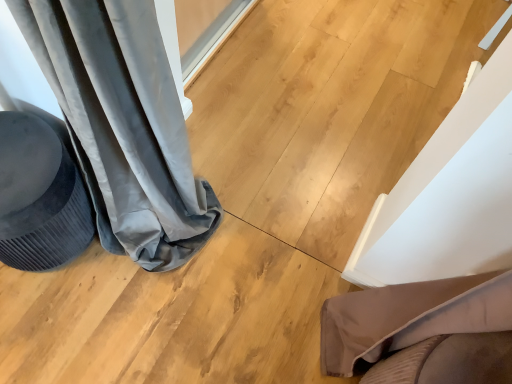
Question: Looking at the image, does brown fabric cushion at lower right seem bigger or smaller compared to velvet dark gray swivel chair at left?

Choices:
 (A) small
 (B) big

Answer: (A)

Question: Is brown fabric cushion at lower right taller or shorter than velvet dark gray swivel chair at left?

Choices:
 (A) tall
 (B) short

Answer: (A)

Question: From a real-world perspective, is brown fabric cushion at lower right above or below velvet dark gray swivel chair at left?

Choices:
 (A) above
 (B) below

Answer: (A)

Question: Visually, is velvet dark gray swivel chair at left positioned to the left or to the right of brown fabric cushion at lower right?

Choices:
 (A) right
 (B) left

Answer: (B)

Question: Is velvet dark gray swivel chair at left spatially inside brown fabric cushion at lower right, or outside of it?

Choices:
 (A) outside
 (B) inside

Answer: (A)

Question: Considering their positions, is velvet dark gray swivel chair at left located in front of or behind brown fabric cushion at lower right?

Choices:
 (A) behind
 (B) front

Answer: (A)

Question: From the image's perspective, is velvet dark gray swivel chair at left positioned above or below brown fabric cushion at lower right?

Choices:
 (A) above
 (B) below

Answer: (A)